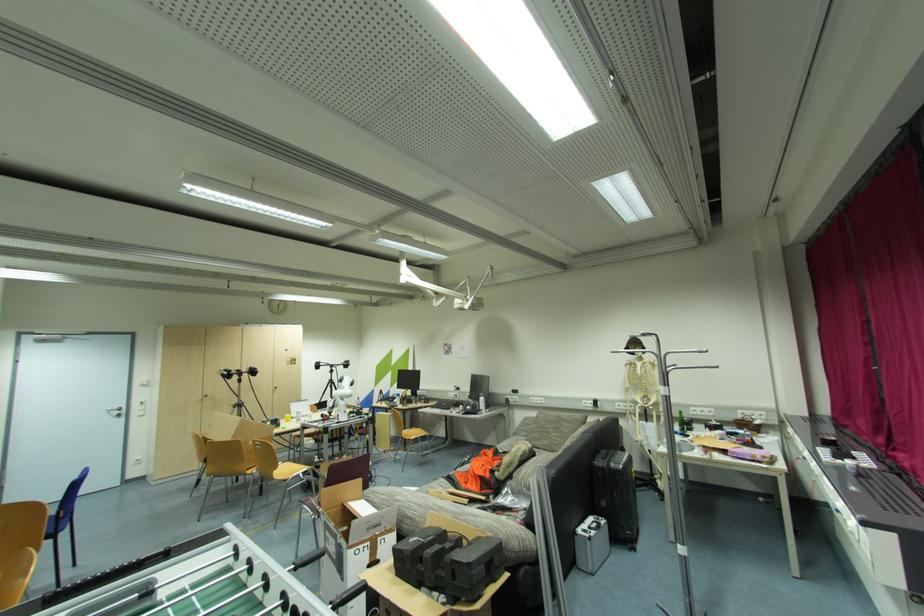
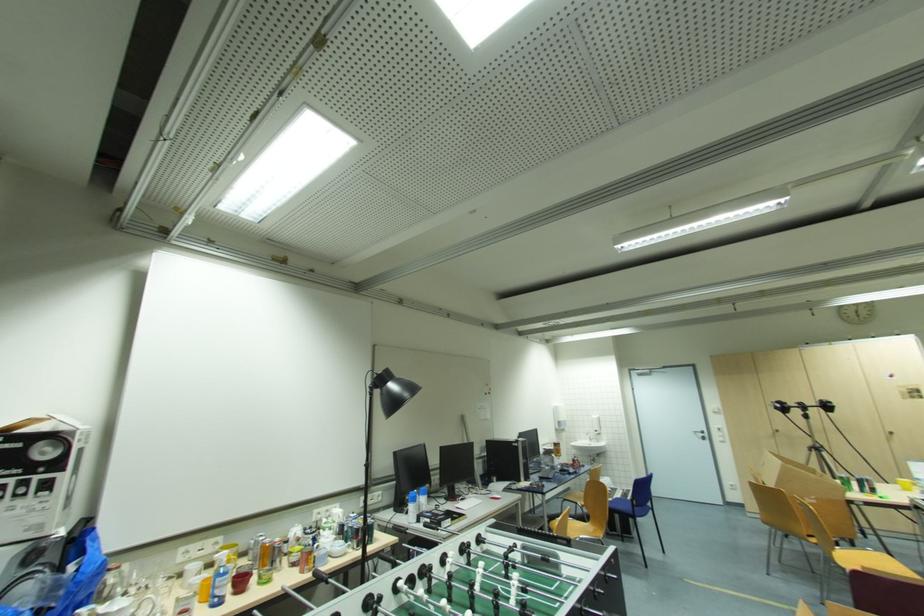
The point at (67, 517) is marked in the first image. Where is the corresponding point in the second image?

(639, 506)